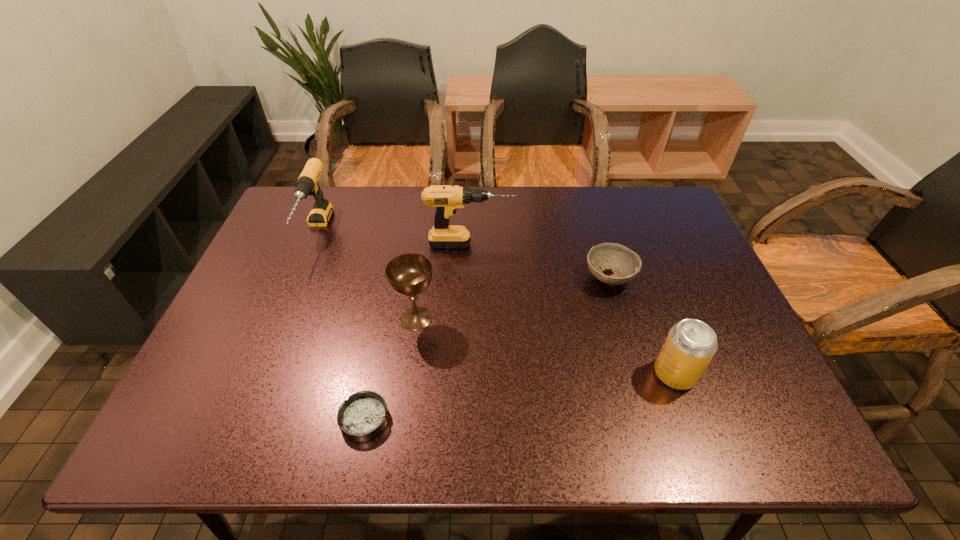
You are a GUI agent. You are given a task and a screenshot of the screen. Output one action in this format:
    pyautogui.click(x=<x>, y=<y>)
    Task: Click on the vacant space at the far edge of the desktop
    This screenshot has width=960, height=540.
    Given the screenshot: What is the action you would take?
    pyautogui.click(x=420, y=202)

In the image, there is a desktop. In order to click on blank space at the near edge in this screenshot , I will do (496, 413).

You are a GUI agent. You are given a task and a screenshot of the screen. Output one action in this format:
    pyautogui.click(x=<x>, y=<y>)
    Task: Click on the free space at the left edge of the desktop
    
    Given the screenshot: What is the action you would take?
    pyautogui.click(x=242, y=402)

At what (x,y) coordinates should I click in order to perform the action: click on blank space at the right edge. Please return your answer as a coordinate pair (x, y). The height and width of the screenshot is (540, 960). Looking at the image, I should click on (719, 306).

The width and height of the screenshot is (960, 540). In the image, there is a desktop. Find the location of `vacant space at the far right corner`. vacant space at the far right corner is located at coordinates (624, 205).

Locate an element on the screen. The image size is (960, 540). vacant area that lies between the right drill and the bowl is located at coordinates (540, 261).

Identify the location of vacant region between the right drill and the fifth tallest object. The width and height of the screenshot is (960, 540). (540, 261).

Find the location of a particular element. The width and height of the screenshot is (960, 540). vacant region between the ashtray and the bowl is located at coordinates (487, 348).

You are a GUI agent. You are given a task and a screenshot of the screen. Output one action in this format:
    pyautogui.click(x=<x>, y=<y>)
    Task: Click on the free spot between the leftmost object and the ashtray
    
    Given the screenshot: What is the action you would take?
    pyautogui.click(x=341, y=325)

Image resolution: width=960 pixels, height=540 pixels. I want to click on unoccupied area between the fourth farthest object and the right drill, so click(444, 281).